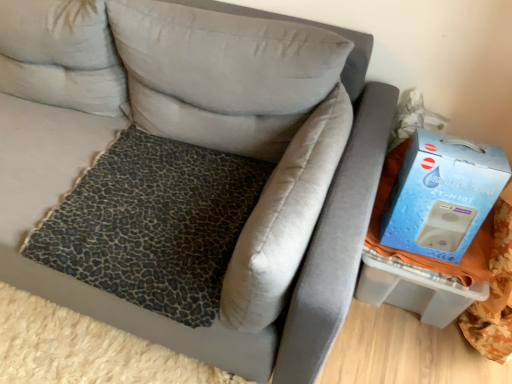
What are the coordinates of `light gray fabric pillow at upper left, acting as the first pillow starting from the left` in the screenshot? It's located at (60, 55).

Measure the distance between point (274, 186) and camera.

Point (274, 186) is 3.67 feet away from camera.

You are a GUI agent. You are given a task and a screenshot of the screen. Output one action in this format:
    pyautogui.click(x=<x>, y=<y>)
    Task: Click on the light gray fabric pillow at upper left, marked as the third pillow in a right-to-left arrangement
    The width and height of the screenshot is (512, 384).
    Given the screenshot: What is the action you would take?
    pyautogui.click(x=60, y=55)

Is blue cardboard box at right not near light gray fabric pillow at upper left, marked as the third pillow in a right-to-left arrangement?

That's right, there is a large distance between blue cardboard box at right and light gray fabric pillow at upper left, marked as the third pillow in a right-to-left arrangement.

In the image, is blue cardboard box at right on the left side or the right side of light gray fabric pillow at upper left, marked as the third pillow in a right-to-left arrangement?

blue cardboard box at right is positioned on light gray fabric pillow at upper left, marked as the third pillow in a right-to-left arrangement,'s right side.

Is the depth of blue cardboard box at right less than that of light gray fabric pillow at upper left, acting as the first pillow starting from the left?

Yes, it is in front of light gray fabric pillow at upper left, acting as the first pillow starting from the left.

Is blue cardboard box at right positioned beyond the bounds of light gray fabric pillow at upper left, acting as the first pillow starting from the left?

Indeed, blue cardboard box at right is completely outside light gray fabric pillow at upper left, acting as the first pillow starting from the left.

Does point (169, 310) come behind point (288, 49)?

That is False.

From the image's perspective, who appears lower, leopard print fabric at center or leopard print fabric pillow at center, marked as the second pillow in a right-to-left arrangement?

leopard print fabric at center is shown below in the image.

Identify the location of pillow that is the 2nd one when counting upward from the leopard print fabric pillow at center, the 3th pillow when ordered from left to right (from the image's perspective). (60, 55).

Does leopard print fabric pillow at center, the 1th pillow from the right, contain light gray fabric pillow at upper left, marked as the third pillow in a right-to-left arrangement?

No, light gray fabric pillow at upper left, marked as the third pillow in a right-to-left arrangement, is located outside of leopard print fabric pillow at center, the 1th pillow from the right.

Consider the image. Could you measure the distance between leopard print fabric pillow at center, the 3th pillow when ordered from left to right, and light gray fabric pillow at upper left, acting as the first pillow starting from the left?

A distance of 87.80 centimeters exists between leopard print fabric pillow at center, the 3th pillow when ordered from left to right, and light gray fabric pillow at upper left, acting as the first pillow starting from the left.

Is leopard print fabric pillow at center, the 3th pillow when ordered from left to right, taller than light gray fabric pillow at upper left, marked as the third pillow in a right-to-left arrangement?

No, leopard print fabric pillow at center, the 3th pillow when ordered from left to right, is not taller than light gray fabric pillow at upper left, marked as the third pillow in a right-to-left arrangement.

From the image's perspective, which is below, leopard print fabric pillow at center, marked as the second pillow in a right-to-left arrangement, or light gray fabric pillow at upper left, acting as the first pillow starting from the left?

leopard print fabric pillow at center, marked as the second pillow in a right-to-left arrangement.

Can you tell me how much leopard print fabric pillow at center, arranged as the second pillow when viewed from the left, and light gray fabric pillow at upper left, acting as the first pillow starting from the left, differ in facing direction?

The angular difference between leopard print fabric pillow at center, arranged as the second pillow when viewed from the left, and light gray fabric pillow at upper left, acting as the first pillow starting from the left, is 3.51 degrees.

Considering the sizes of objects leopard print fabric pillow at center, marked as the second pillow in a right-to-left arrangement, and light gray fabric pillow at upper left, acting as the first pillow starting from the left, in the image provided, who is shorter, leopard print fabric pillow at center, marked as the second pillow in a right-to-left arrangement, or light gray fabric pillow at upper left, acting as the first pillow starting from the left,?

With less height is leopard print fabric pillow at center, marked as the second pillow in a right-to-left arrangement.

Who is smaller, leopard print fabric pillow at center, marked as the second pillow in a right-to-left arrangement, or light gray fabric pillow at upper left, marked as the third pillow in a right-to-left arrangement?

light gray fabric pillow at upper left, marked as the third pillow in a right-to-left arrangement.

Which object is further away from the camera, light gray fabric pillow at upper left, acting as the first pillow starting from the left, or leopard print fabric pillow at center, the 1th pillow from the right?

Positioned behind is light gray fabric pillow at upper left, acting as the first pillow starting from the left.

Could you tell me if light gray fabric pillow at upper left, marked as the third pillow in a right-to-left arrangement, is turned towards leopard print fabric pillow at center, the 3th pillow when ordered from left to right?

No, light gray fabric pillow at upper left, marked as the third pillow in a right-to-left arrangement, is not turned towards leopard print fabric pillow at center, the 3th pillow when ordered from left to right.

What's the angular difference between light gray fabric pillow at upper left, marked as the third pillow in a right-to-left arrangement, and leopard print fabric pillow at center, the 3th pillow when ordered from left to right,'s facing directions?

94.1 degrees.

Considering the sizes of objects light gray fabric pillow at upper left, marked as the third pillow in a right-to-left arrangement, and leopard print fabric pillow at center, the 1th pillow from the right, in the image provided, who is smaller, light gray fabric pillow at upper left, marked as the third pillow in a right-to-left arrangement, or leopard print fabric pillow at center, the 1th pillow from the right,?

leopard print fabric pillow at center, the 1th pillow from the right, is smaller.

Considering the positions of objects light gray fabric pillow at upper left, acting as the first pillow starting from the left, and blue cardboard box at right in the image provided, who is in front, light gray fabric pillow at upper left, acting as the first pillow starting from the left, or blue cardboard box at right?

blue cardboard box at right.

How distant is light gray fabric pillow at upper left, acting as the first pillow starting from the left, from blue cardboard box at right?

light gray fabric pillow at upper left, acting as the first pillow starting from the left, and blue cardboard box at right are 3.84 feet apart from each other.

Is the surface of light gray fabric pillow at upper left, marked as the third pillow in a right-to-left arrangement, in direct contact with blue cardboard box at right?

No, light gray fabric pillow at upper left, marked as the third pillow in a right-to-left arrangement, is not beside blue cardboard box at right.

Is point (383, 221) positioned before point (269, 204)?

That is False.

Is blue cardboard box at right bigger or smaller than leopard print fabric pillow at center, the 3th pillow when ordered from left to right?

Considering their sizes, blue cardboard box at right takes up less space than leopard print fabric pillow at center, the 3th pillow when ordered from left to right.

From the image's perspective, which object appears higher, blue cardboard box at right or leopard print fabric pillow at center, the 3th pillow when ordered from left to right?

blue cardboard box at right.

From the picture: Is blue cardboard box at right not inside leopard print fabric pillow at center, the 1th pillow from the right?

blue cardboard box at right lies outside leopard print fabric pillow at center, the 1th pillow from the right,'s area.

From a real-world perspective, which pillow is the 1st one above the blue cardboard box at right? Please provide its 2D coordinates.

[(60, 55)]

I want to click on mat on the left of leopard print fabric pillow at center, arranged as the second pillow when viewed from the left, so click(153, 224).

Considering their positions, is leopard print fabric pillow at center, marked as the second pillow in a right-to-left arrangement, positioned closer to leopard print fabric at center than blue cardboard box at right?

The object closer to leopard print fabric at center is leopard print fabric pillow at center, marked as the second pillow in a right-to-left arrangement.

From the picture: Estimate the real-world distances between objects in this image. Which object is closer to leopard print fabric at center, leopard print fabric pillow at center, arranged as the second pillow when viewed from the left, or leopard print fabric pillow at center, the 1th pillow from the right?

leopard print fabric pillow at center, the 1th pillow from the right, is positioned closer to the anchor leopard print fabric at center.

Estimate the real-world distances between objects in this image. Which object is closer to blue cardboard box at right, leopard print fabric at center or leopard print fabric pillow at center, arranged as the second pillow when viewed from the left?

Based on the image, leopard print fabric pillow at center, arranged as the second pillow when viewed from the left, appears to be nearer to blue cardboard box at right.

Based on their spatial positions, is blue cardboard box at right or light gray fabric pillow at upper left, marked as the third pillow in a right-to-left arrangement, further from leopard print fabric pillow at center, marked as the second pillow in a right-to-left arrangement?

blue cardboard box at right.

Consider the image. Considering their positions, is leopard print fabric pillow at center, the 3th pillow when ordered from left to right, positioned closer to light gray fabric pillow at upper left, marked as the third pillow in a right-to-left arrangement, than leopard print fabric pillow at center, arranged as the second pillow when viewed from the left?

Among the two, leopard print fabric pillow at center, arranged as the second pillow when viewed from the left, is located nearer to light gray fabric pillow at upper left, marked as the third pillow in a right-to-left arrangement.

Which object lies nearer to the anchor point leopard print fabric pillow at center, the 3th pillow when ordered from left to right, blue cardboard box at right or leopard print fabric at center?

leopard print fabric at center is closer to leopard print fabric pillow at center, the 3th pillow when ordered from left to right.

When comparing their distances from light gray fabric pillow at upper left, acting as the first pillow starting from the left, does blue cardboard box at right or leopard print fabric pillow at center, arranged as the second pillow when viewed from the left, seem further?

blue cardboard box at right.

Estimate the real-world distances between objects in this image. Which object is further from leopard print fabric pillow at center, arranged as the second pillow when viewed from the left, blue cardboard box at right or leopard print fabric at center?

Among the two, blue cardboard box at right is located further to leopard print fabric pillow at center, arranged as the second pillow when viewed from the left.

The height and width of the screenshot is (384, 512). Identify the location of mat between light gray fabric pillow at upper left, marked as the third pillow in a right-to-left arrangement, and blue cardboard box at right from left to right. coord(153,224).

I want to click on pillow located between leopard print fabric pillow at center, arranged as the second pillow when viewed from the left, and blue cardboard box at right in the left-right direction, so click(x=285, y=218).

Find the location of `mat between light gray fabric pillow at upper left, marked as the third pillow in a right-to-left arrangement, and leopard print fabric pillow at center, the 1th pillow from the right`. mat between light gray fabric pillow at upper left, marked as the third pillow in a right-to-left arrangement, and leopard print fabric pillow at center, the 1th pillow from the right is located at coordinates (153, 224).

Where is `mat located between light gray fabric pillow at upper left, marked as the third pillow in a right-to-left arrangement, and leopard print fabric pillow at center, marked as the second pillow in a right-to-left arrangement, in the left-right direction`? Image resolution: width=512 pixels, height=384 pixels. mat located between light gray fabric pillow at upper left, marked as the third pillow in a right-to-left arrangement, and leopard print fabric pillow at center, marked as the second pillow in a right-to-left arrangement, in the left-right direction is located at coordinates (153, 224).